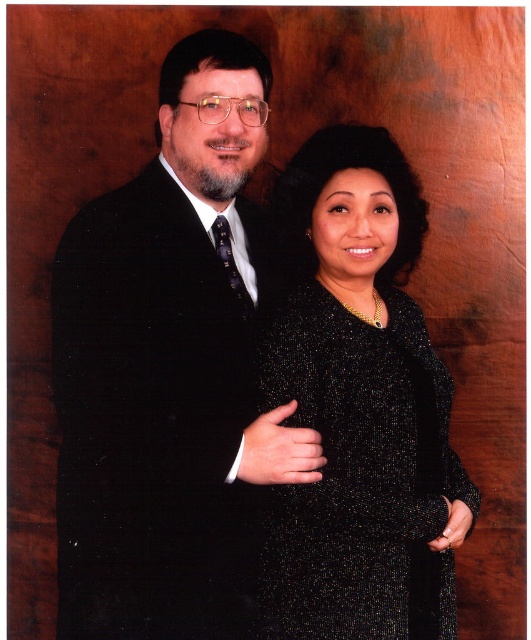
Question: Where is matte black suit at left located in relation to black sequined dress at center in the image?

Choices:
 (A) below
 (B) above

Answer: (B)

Question: Which point is closer to the camera?

Choices:
 (A) matte black suit at left
 (B) black sequined dress at center

Answer: (A)

Question: Observing the image, what is the correct spatial positioning of matte black suit at left in reference to black sequined dress at center?

Choices:
 (A) right
 (B) left

Answer: (B)

Question: Which of the following is the closest to the observer?

Choices:
 (A) (337, 490)
 (B) (64, 362)

Answer: (B)

Question: Is matte black suit at left closer to the viewer compared to black sequined dress at center?

Choices:
 (A) no
 (B) yes

Answer: (B)